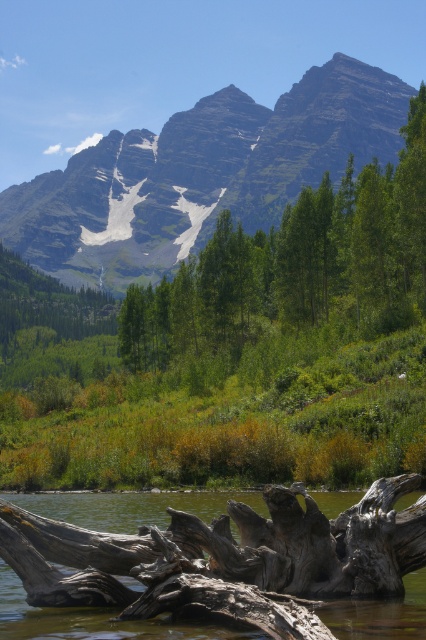
Question: Which point is farther from the camera taking this photo?

Choices:
 (A) (109, 275)
 (B) (161, 595)

Answer: (A)

Question: Which point is farther to the camera?

Choices:
 (A) (389, 92)
 (B) (267, 536)

Answer: (A)

Question: Does green grassy mountain at upper center appear under gray wood log at lower center?

Choices:
 (A) yes
 (B) no

Answer: (B)

Question: Is green grassy mountain at upper center above gray wood log at lower center?

Choices:
 (A) yes
 (B) no

Answer: (A)

Question: Does green grassy mountain at upper center come in front of gray wood log at lower center?

Choices:
 (A) yes
 (B) no

Answer: (B)

Question: Which object is farther from the camera taking this photo?

Choices:
 (A) green grassy mountain at upper center
 (B) gray wood log at lower center

Answer: (A)